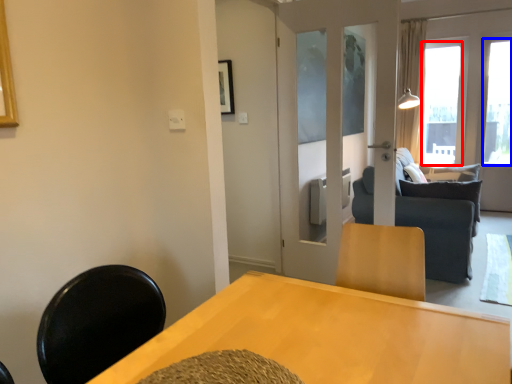
Question: Which object is closer to the camera taking this photo, window (highlighted by a red box) or window (highlighted by a blue box)?

Choices:
 (A) window
 (B) window

Answer: (B)